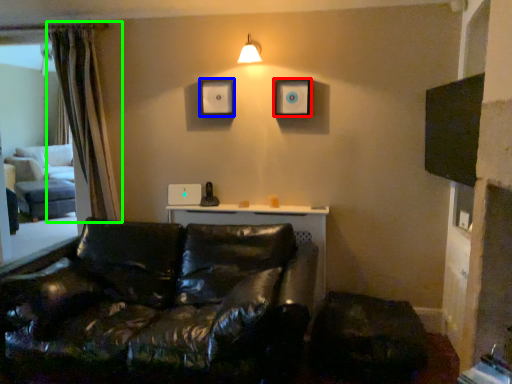
Question: Which is nearer to the picture frame (highlighted by a red box)? picture frame (highlighted by a blue box) or curtain (highlighted by a green box).

Choices:
 (A) picture frame
 (B) curtain

Answer: (A)